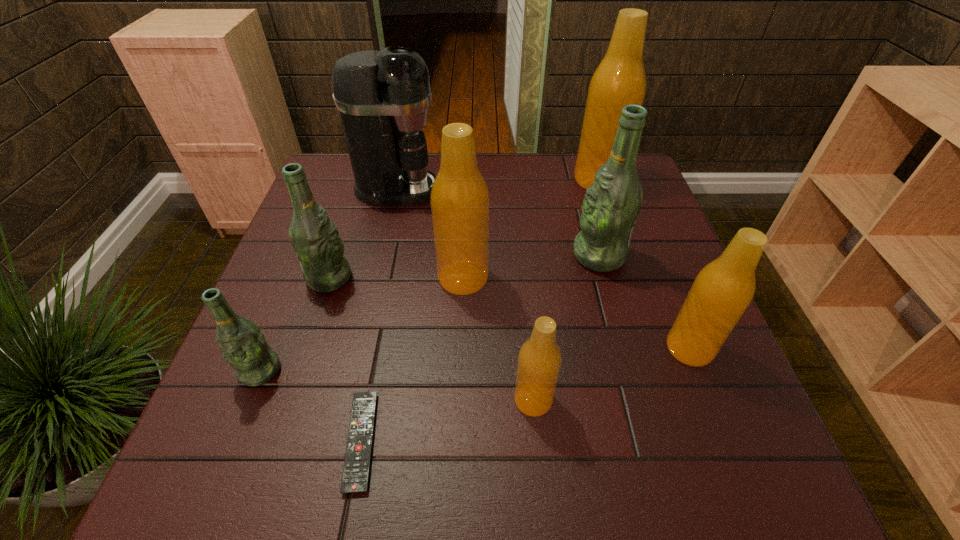
Where is `vacant space at the near edge`? Image resolution: width=960 pixels, height=540 pixels. vacant space at the near edge is located at coordinates (339, 480).

Identify the location of free space at the left edge of the desktop. (296, 333).

Where is `vacant space at the right edge of the desktop`? The width and height of the screenshot is (960, 540). vacant space at the right edge of the desktop is located at coordinates (759, 440).

In the image, there is a desktop. Identify the location of free region at the near left corner. The width and height of the screenshot is (960, 540). (252, 473).

Identify the location of unoccupied position between the second smallest tan beer bottle and the nearest green beer bottle. (475, 360).

The image size is (960, 540). Find the location of `unoccupied area between the farthest beer bottle and the leftmost tan beer bottle`. unoccupied area between the farthest beer bottle and the leftmost tan beer bottle is located at coordinates (530, 229).

This screenshot has width=960, height=540. Find the location of `free space between the second farthest tan beer bottle and the coffee maker`. free space between the second farthest tan beer bottle and the coffee maker is located at coordinates (430, 233).

Locate an element on the screen. vacant space that is in between the third tan beer bottle from right to left and the rightmost green beer bottle is located at coordinates (566, 328).

I want to click on vacant space that is in between the fourth object from right to left and the fifth object from left to right, so click(498, 339).

Where is `free space between the fourth beer bottle from left to right and the rightmost green beer bottle`? free space between the fourth beer bottle from left to right and the rightmost green beer bottle is located at coordinates (566, 328).